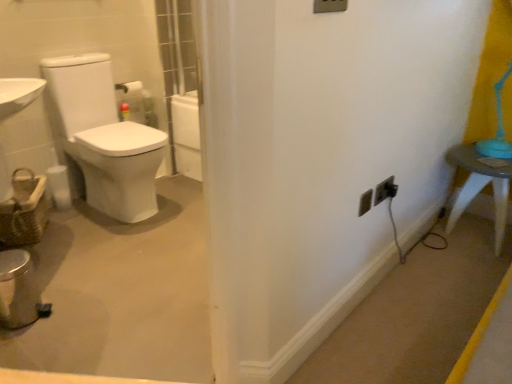
Image resolution: width=512 pixels, height=384 pixels. I want to click on white plastic outlet at lower right, the first electric outlet when ordered from left to right, so click(365, 202).

What do you see at coordinates (105, 137) in the screenshot?
I see `white glossy toilet at left` at bounding box center [105, 137].

Describe the element at coordinates (391, 189) in the screenshot. This screenshot has width=512, height=384. I see `black plastic outlet at lower right, placed as the 3th electric outlet when sorted from left to right` at that location.

At what (x,y) coordinates should I click in order to perform the action: click on white plastic table at right. Please return your answer as a coordinate pair (x, y). Looking at the image, I should click on (480, 186).

Image resolution: width=512 pixels, height=384 pixels. What do you see at coordinates (480, 186) in the screenshot?
I see `white plastic table at right` at bounding box center [480, 186].

Where is `woven brown basket at left`? The height and width of the screenshot is (384, 512). woven brown basket at left is located at coordinates (24, 210).

What is the approximate height of white plastic light switch at upper center?

white plastic light switch at upper center is 9.18 centimeters tall.

Where is `black plastic electrical outlet at lower right, arranged as the 2th electric outlet when viewed from the left`? The image size is (512, 384). black plastic electrical outlet at lower right, arranged as the 2th electric outlet when viewed from the left is located at coordinates (385, 190).

Does point (366, 194) come farther from viewer compared to point (11, 230)?

No, it is in front of (11, 230).

Which object is closer to the camera, white plastic outlet at lower right, which appears as the third electric outlet when viewed from the right, or woven brown basket at left?

white plastic outlet at lower right, which appears as the third electric outlet when viewed from the right, is closer to the camera.

From a real-world perspective, between white plastic outlet at lower right, the first electric outlet when ordered from left to right, and woven brown basket at left, who is vertically lower?

woven brown basket at left is physically lower.

From the image's perspective, between white plastic outlet at lower right, the first electric outlet when ordered from left to right, and woven brown basket at left, which one is located above?

white plastic outlet at lower right, the first electric outlet when ordered from left to right, from the image's perspective.

Can you confirm if black plastic outlet at lower right, which is counted as the 1th electric outlet, starting from the right, is positioned to the right of white plastic table at right?

No.

Between black plastic outlet at lower right, placed as the 3th electric outlet when sorted from left to right, and white plastic table at right, which one has smaller width?

Thinner between the two is black plastic outlet at lower right, placed as the 3th electric outlet when sorted from left to right.

Considering the sizes of objects black plastic outlet at lower right, which is counted as the 1th electric outlet, starting from the right, and white plastic table at right in the image provided, who is shorter, black plastic outlet at lower right, which is counted as the 1th electric outlet, starting from the right, or white plastic table at right?

With less height is black plastic outlet at lower right, which is counted as the 1th electric outlet, starting from the right.

How many degrees apart are the facing directions of black plastic outlet at lower right, which is counted as the 1th electric outlet, starting from the right, and white plastic table at right?

The angle between the facing direction of black plastic outlet at lower right, which is counted as the 1th electric outlet, starting from the right, and the facing direction of white plastic table at right is 90.8 degrees.

Find the location of a particular element. This screenshot has width=512, height=384. basket below the white plastic light switch at upper center (from a real-world perspective) is located at coordinates (24, 210).

Are woven brown basket at left and white plastic light switch at upper center located far from each other?

Yes, woven brown basket at left and white plastic light switch at upper center are located far from each other.

From the image's perspective, which one is positioned lower, woven brown basket at left or white plastic light switch at upper center?

woven brown basket at left, from the image's perspective.

From a real-world perspective, is woven brown basket at left positioned above or below white plastic light switch at upper center?

woven brown basket at left is situated lower than white plastic light switch at upper center in the real world.

Is woven brown basket at left to the left of white glossy toilet at left from the viewer's perspective?

Yes, woven brown basket at left is to the left of white glossy toilet at left.

In terms of height, does woven brown basket at left look taller or shorter compared to white glossy toilet at left?

Clearly, woven brown basket at left is shorter compared to white glossy toilet at left.

Looking at this image, can you confirm if woven brown basket at left is wider than white glossy toilet at left?

No, woven brown basket at left is not wider than white glossy toilet at left.

Considering the points (395, 188) and (328, 9), which point is in front, point (395, 188) or point (328, 9)?

The point (328, 9) is closer to the camera.

From the picture: From the image's perspective, which one is positioned higher, black plastic outlet at lower right, placed as the 3th electric outlet when sorted from left to right, or white plastic light switch at upper center?

From the image's view, white plastic light switch at upper center is above.

Is black plastic outlet at lower right, which is counted as the 1th electric outlet, starting from the right, at the right side of white plastic light switch at upper center?

Correct, you'll find black plastic outlet at lower right, which is counted as the 1th electric outlet, starting from the right, to the right of white plastic light switch at upper center.

In the scene shown: Does black plastic outlet at lower right, which is counted as the 1th electric outlet, starting from the right, turn towards white plastic light switch at upper center?

No.

Starting from the white plastic light switch at upper center, which electric outlet is the 2nd one to the right? Please provide its 2D coordinates.

[(385, 190)]

In the scene shown: From the image's perspective, who appears lower, white plastic light switch at upper center or black plastic electrical outlet at lower right, which appears as the 2th electric outlet when viewed from the right?

black plastic electrical outlet at lower right, which appears as the 2th electric outlet when viewed from the right, is shown below in the image.

Based on the photo, can you confirm if white plastic light switch at upper center is wider than black plastic electrical outlet at lower right, arranged as the 2th electric outlet when viewed from the left?

Incorrect, the width of white plastic light switch at upper center does not surpass that of black plastic electrical outlet at lower right, arranged as the 2th electric outlet when viewed from the left.

Looking at the image, does white plastic light switch at upper center seem bigger or smaller compared to black plastic electrical outlet at lower right, which appears as the 2th electric outlet when viewed from the right?

white plastic light switch at upper center is smaller than black plastic electrical outlet at lower right, which appears as the 2th electric outlet when viewed from the right.

From a real-world perspective, which object rests below the other?

white glossy toilet at left is physically lower.

Considering the sizes of objects white glossy toilet at left and white plastic light switch at upper center in the image provided, who is thinner, white glossy toilet at left or white plastic light switch at upper center?

white plastic light switch at upper center.

Is point (108, 214) less distant than point (342, 3)?

No, it is behind (342, 3).

Is white glossy toilet at left positioned beyond the bounds of white plastic light switch at upper center?

Yes.

Identify the location of basket located underneath the white plastic outlet at lower right, which appears as the third electric outlet when viewed from the right (from a real-world perspective). Image resolution: width=512 pixels, height=384 pixels. (24, 210).

Which electric outlet is the 1st one when counting from the front of the white plastic table at right? Please provide its 2D coordinates.

[(391, 189)]

From the picture: Considering their positions, is white plastic outlet at lower right, which appears as the third electric outlet when viewed from the right, positioned further to black plastic electrical outlet at lower right, arranged as the 2th electric outlet when viewed from the left, than white glossy toilet at left?

Based on the image, white glossy toilet at left appears to be further to black plastic electrical outlet at lower right, arranged as the 2th electric outlet when viewed from the left.

Based on the photo, when comparing their distances from woven brown basket at left, does black plastic outlet at lower right, placed as the 3th electric outlet when sorted from left to right, or white plastic outlet at lower right, the first electric outlet when ordered from left to right, seem closer?

white plastic outlet at lower right, the first electric outlet when ordered from left to right, is closer to woven brown basket at left.

When comparing their distances from white plastic light switch at upper center, does white plastic table at right or black plastic electrical outlet at lower right, which appears as the 2th electric outlet when viewed from the right, seem closer?

Based on the image, black plastic electrical outlet at lower right, which appears as the 2th electric outlet when viewed from the right, appears to be nearer to white plastic light switch at upper center.

Estimate the real-world distances between objects in this image. Which object is further from white plastic outlet at lower right, which appears as the third electric outlet when viewed from the right, black plastic electrical outlet at lower right, arranged as the 2th electric outlet when viewed from the left, or white plastic table at right?

white plastic table at right lies further to white plastic outlet at lower right, which appears as the third electric outlet when viewed from the right, than the other object.

Considering their positions, is white plastic light switch at upper center positioned further to black plastic outlet at lower right, which is counted as the 1th electric outlet, starting from the right, than white plastic outlet at lower right, the first electric outlet when ordered from left to right?

white plastic light switch at upper center.

Looking at the image, which one is located closer to white plastic light switch at upper center, white glossy toilet at left or white plastic outlet at lower right, which appears as the third electric outlet when viewed from the right?

Among the two, white plastic outlet at lower right, which appears as the third electric outlet when viewed from the right, is located nearer to white plastic light switch at upper center.

Based on their spatial positions, is white plastic light switch at upper center or white glossy toilet at left closer to woven brown basket at left?

The object closer to woven brown basket at left is white glossy toilet at left.

Looking at the image, which one is located further to black plastic electrical outlet at lower right, arranged as the 2th electric outlet when viewed from the left, black plastic outlet at lower right, placed as the 3th electric outlet when sorted from left to right, or white plastic table at right?

white plastic table at right lies further to black plastic electrical outlet at lower right, arranged as the 2th electric outlet when viewed from the left, than the other object.

In order to click on light switch between white glossy toilet at left and black plastic outlet at lower right, which is counted as the 1th electric outlet, starting from the right in this screenshot , I will do `click(330, 6)`.

Where is `toilet between woven brown basket at left and white plastic outlet at lower right, the first electric outlet when ordered from left to right, from left to right`? toilet between woven brown basket at left and white plastic outlet at lower right, the first electric outlet when ordered from left to right, from left to right is located at coordinates (105, 137).

This screenshot has height=384, width=512. Find the location of `electric outlet between white plastic outlet at lower right, which appears as the third electric outlet when viewed from the right, and black plastic outlet at lower right, placed as the 3th electric outlet when sorted from left to right, in the horizontal direction`. electric outlet between white plastic outlet at lower right, which appears as the third electric outlet when viewed from the right, and black plastic outlet at lower right, placed as the 3th electric outlet when sorted from left to right, in the horizontal direction is located at coordinates (385, 190).

The width and height of the screenshot is (512, 384). I want to click on toilet between woven brown basket at left and black plastic outlet at lower right, placed as the 3th electric outlet when sorted from left to right, so click(105, 137).